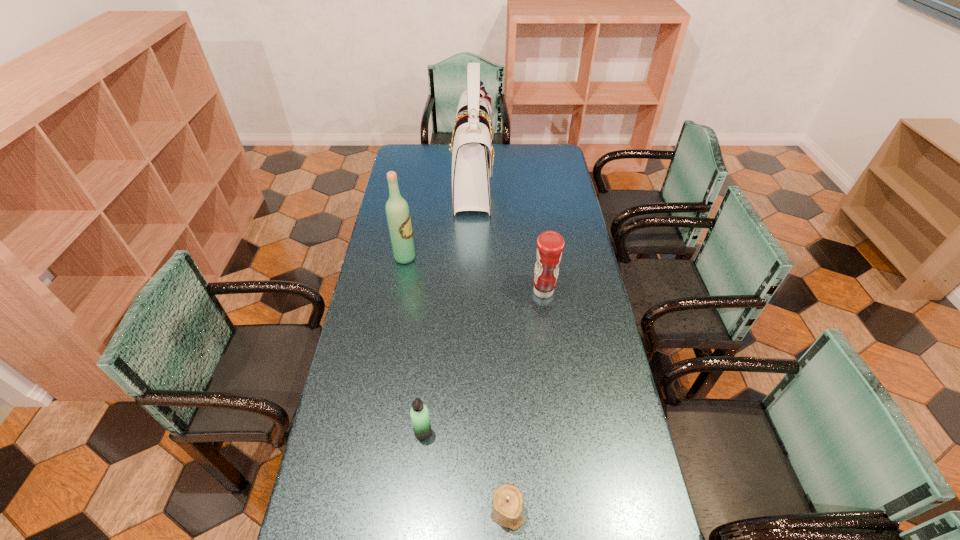
Locate an element on the screen. The height and width of the screenshot is (540, 960). free spot that satisfies the following two spatial constraints: 1. on the front-facing side of the fourth shortest object; 2. on the back side of the condiment is located at coordinates pyautogui.click(x=399, y=292).

Locate an element on the screen. This screenshot has width=960, height=540. vacant point that satisfies the following two spatial constraints: 1. on the front-facing side of the tallest object; 2. on the back side of the shortest object is located at coordinates (466, 512).

Locate an element on the screen. free space that satisfies the following two spatial constraints: 1. on the back side of the condiment; 2. on the right side of the nearest object is located at coordinates (498, 292).

This screenshot has height=540, width=960. I want to click on free space that satisfies the following two spatial constraints: 1. on the front-facing side of the farthest object; 2. on the left side of the rightmost object, so click(470, 292).

I want to click on vacant point that satisfies the following two spatial constraints: 1. on the front-facing side of the farthest object; 2. on the back side of the third farthest object, so click(470, 292).